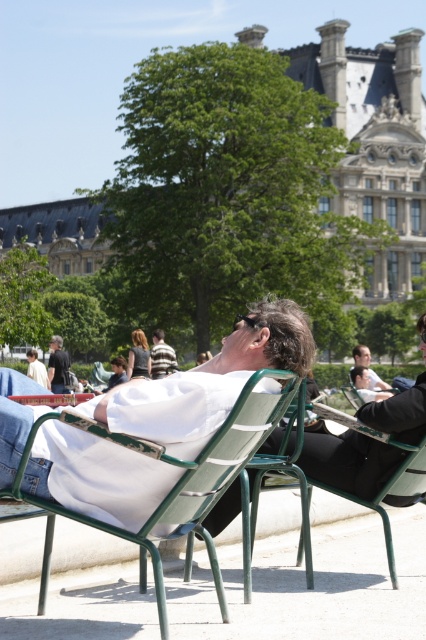
You are a photographer trying to capture a portrait of both the white fabric shirt at center and the smooth skin man at center in this park scene. Since you want to ensure both subjects are fully visible in the frame, which subject should you position closer to the camera to avoid cropping?

The white fabric shirt at center is much taller than the smooth skin man at center, so positioning the smooth skin man at center closer to the camera will help ensure both are fully visible without cropping.

You are a photographer taking a portrait of the two people in the scene. You need to ensure that both the white fabric shirt at center and the blonde hair at center are clearly visible in the frame. Given their sizes, which one might require more careful framing to avoid being too small in the photo?

The blonde hair at center is smaller in size than the white fabric shirt at center, so it might require more careful framing to ensure it remains visible and not too small in the photo.

In the scene, there are two people sitting on green metal chairs. The person on the left is wearing a white outfit, and the person on the right is wearing dark clothing. A point at coordinates (57, 365) marks a specific location. Which object does this point correspond to?

The point at coordinates (57, 365) corresponds to the dark gray shirt at center.